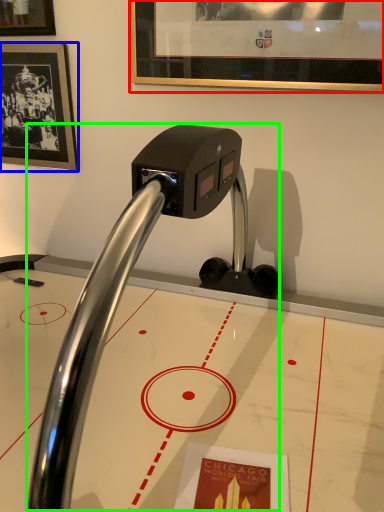
Question: Estimate the real-world distances between objects in this image. Which object is closer to picture frame (highlighted by a red box), picture frame (highlighted by a blue box) or faucet (highlighted by a green box)?

Choices:
 (A) picture frame
 (B) faucet

Answer: (A)